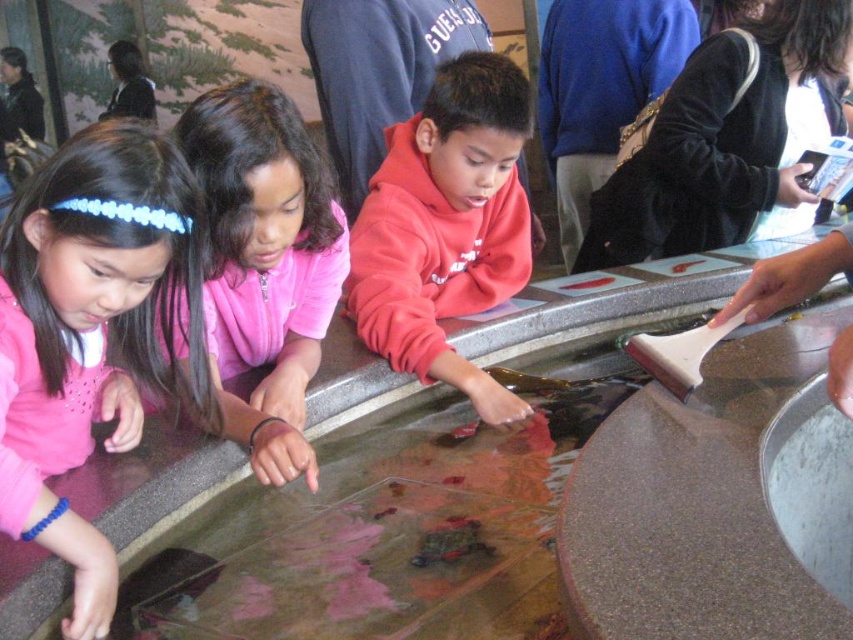
You are a photographer trying to capture a clear shot of the child in the pink fleece jacket at center. However, there is another child in the way. Which child in the pink fleece jacket at left needs to move so you can see the one at center?

The pink fleece jacket at left is in front of the pink fleece jacket at center, so the child wearing the pink fleece jacket at left needs to move to allow a clear view of the one at center.